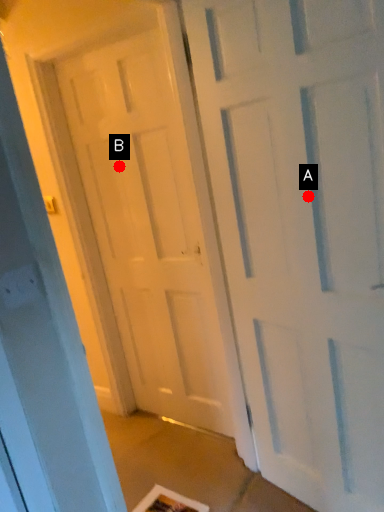
Question: Two points are circled on the image, labeled by A and B beside each circle. Which point appears farthest from the camera in this image?

Choices:
 (A) A is further
 (B) B is further

Answer: (B)